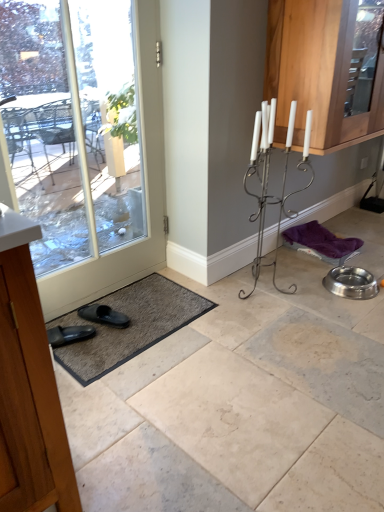
Find the location of a particular element. The image size is (384, 512). vacant location below metallic silver candle holder at center right (from a real-world perspective) is located at coordinates (256, 291).